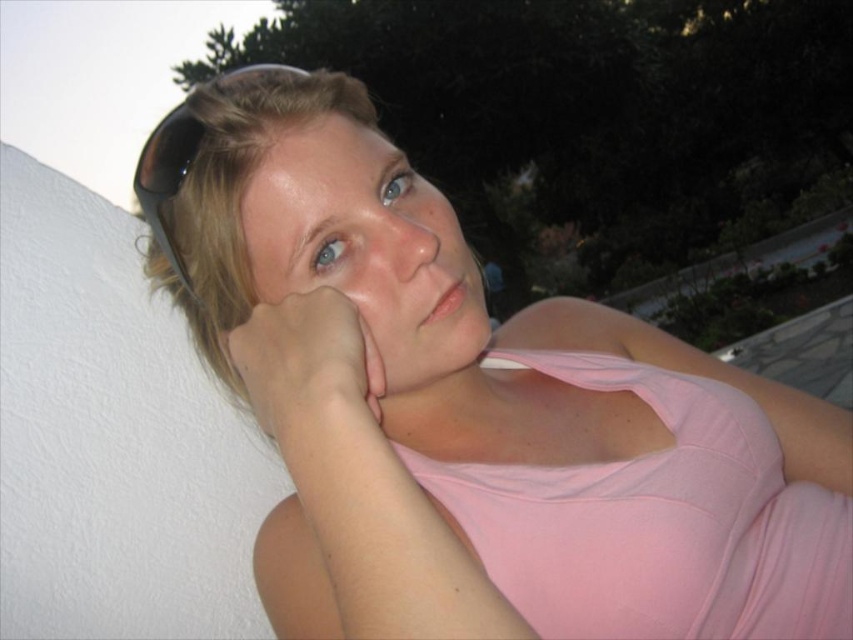
You are a photographer trying to capture the perfect shot of the pink matte hand at center and the black rubber goggles at upper left. Since you want to ensure both objects are clearly visible in your photo, which object should you focus on first if you need to prioritize the one that takes up more space in the frame?

The black rubber goggles at upper left should be focused on first because its width is greater than the pink matte hand at center, making it larger and thus requiring more attention to ensure clarity.

You are an artist trying to sketch this scene. You want to place the pink matte hand at center in your drawing. Where should you position it in terms of coordinates?

The pink matte hand at center should be positioned at coordinates approximately 0.580 on the x axis and 0.365 on the y axis.

Based on the photo, you are standing 20 inches away from the point at coordinates point (367, 397). Can you reach it without moving your feet?

The distance of point (367, 397) from viewer is 18.76 inches, so yes, you can reach it without moving your feet since it is within the 20 inches range.